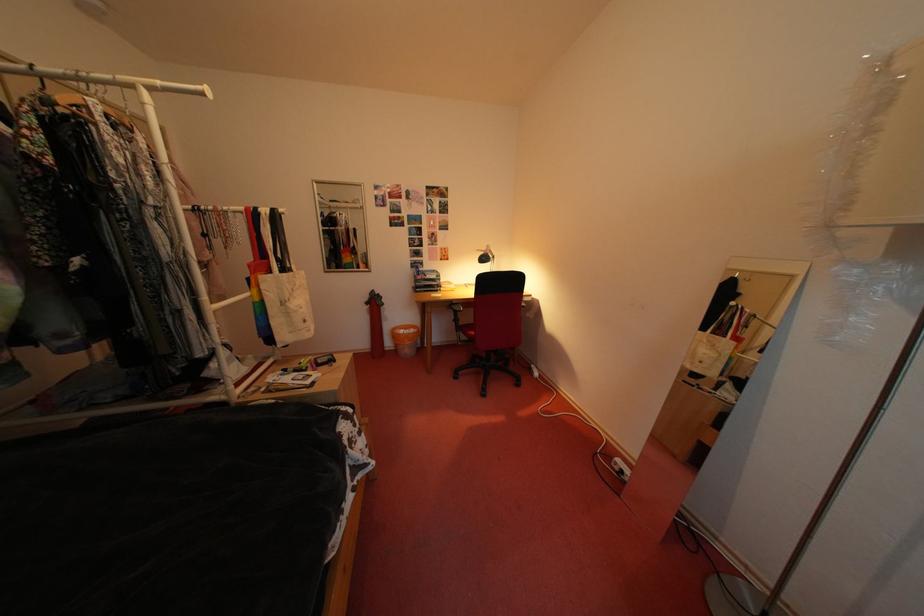
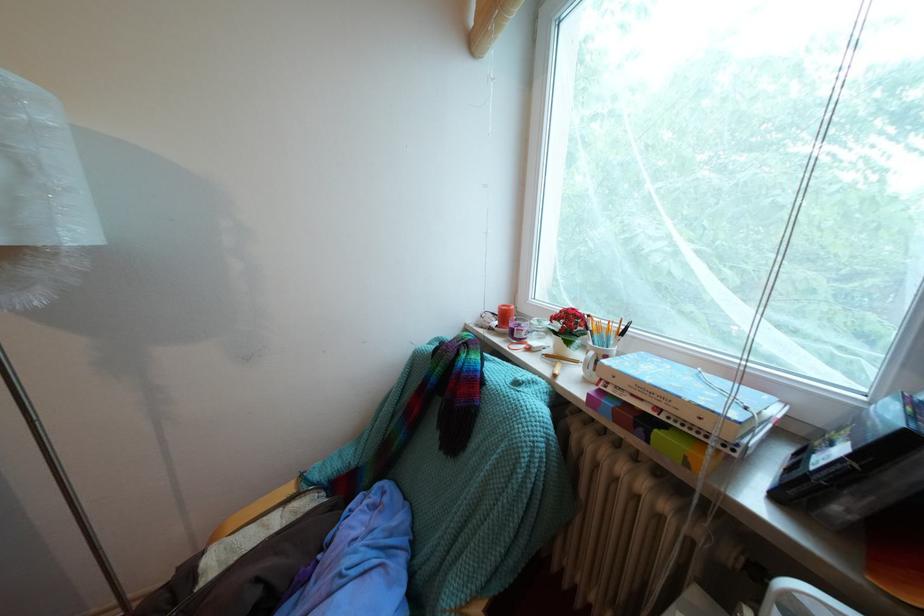
How did the camera likely rotate?

The rotation direction of the camera is right-down.